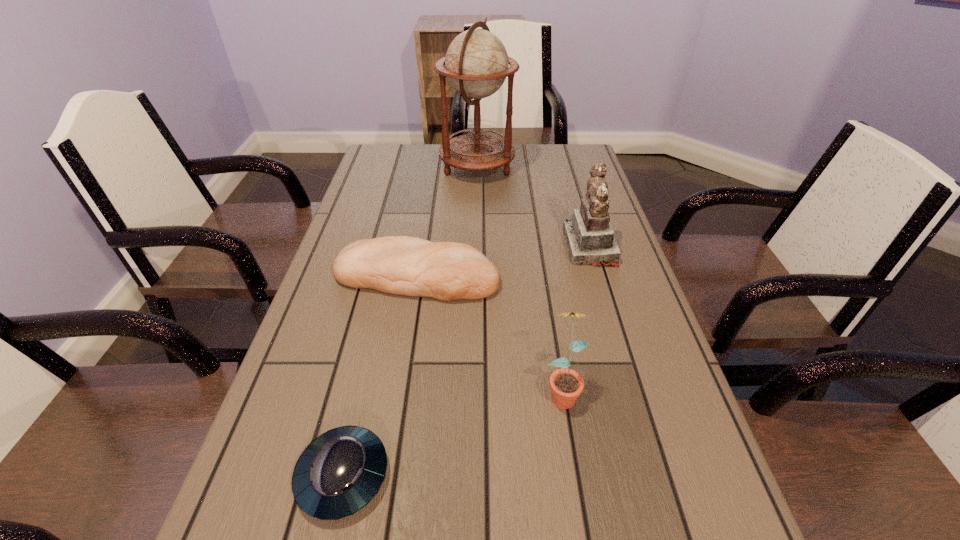
The width and height of the screenshot is (960, 540). I want to click on globe, so click(476, 64).

The width and height of the screenshot is (960, 540). I want to click on the farthest object, so click(x=476, y=64).

At what (x,y) coordinates should I click in order to perform the action: click on figurine. Please return your answer as a coordinate pair (x, y). Image resolution: width=960 pixels, height=540 pixels. Looking at the image, I should click on (590, 240).

Identify the location of the third tallest object. Image resolution: width=960 pixels, height=540 pixels. (566, 385).

This screenshot has width=960, height=540. I want to click on the second nearest object, so tap(566, 385).

Where is `the second shortest object`? This screenshot has height=540, width=960. the second shortest object is located at coordinates (401, 265).

The height and width of the screenshot is (540, 960). I want to click on saucer, so click(x=339, y=472).

Identify the location of the shortest object. (339, 472).

Locate an element on the screen. This screenshot has height=540, width=960. vacant space located 0.170m on the surface of the globe is located at coordinates (565, 166).

The image size is (960, 540). Identify the location of free spot located on the front-facing side of the rightmost object. (497, 247).